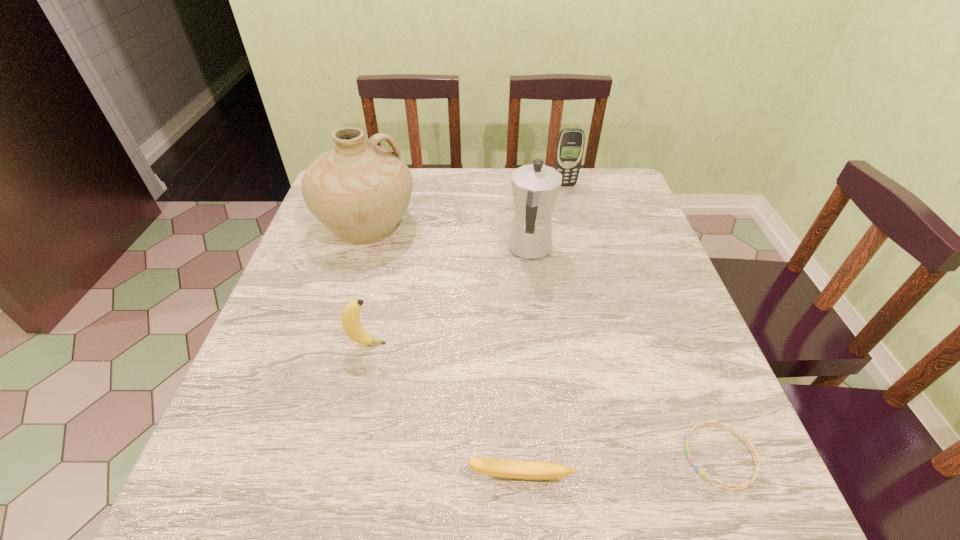
Where is `free space at the right edge of the desktop`? This screenshot has width=960, height=540. free space at the right edge of the desktop is located at coordinates 657,303.

Locate an element on the screen. The width and height of the screenshot is (960, 540). vacant space at the near left corner of the desktop is located at coordinates (291, 495).

This screenshot has width=960, height=540. In the image, there is a desktop. Identify the location of free space at the far right corner. (588, 198).

At what (x,y) coordinates should I click in order to perform the action: click on empty location between the fourth farthest object and the rightmost object. Please return your answer as a coordinate pair (x, y). The width and height of the screenshot is (960, 540). Looking at the image, I should click on (543, 400).

The width and height of the screenshot is (960, 540). Identify the location of blank region between the pottery and the third nearest object. [368, 284].

Find the location of `vacant point located between the fourth farthest object and the shortest object`. vacant point located between the fourth farthest object and the shortest object is located at coordinates (543, 400).

Where is `empty space between the bracelet and the fourth tallest object`? The height and width of the screenshot is (540, 960). empty space between the bracelet and the fourth tallest object is located at coordinates (543, 400).

Where is `vacant area between the farthest object and the pottery`? The height and width of the screenshot is (540, 960). vacant area between the farthest object and the pottery is located at coordinates (466, 205).

Locate an element on the screen. Image resolution: width=960 pixels, height=540 pixels. free space between the coffeepot and the bracelet is located at coordinates (625, 352).

At what (x,y) coordinates should I click in order to perform the action: click on empty space between the fourth shortest object and the farther banana. Please return your answer as a coordinate pair (x, y). The width and height of the screenshot is (960, 540). Looking at the image, I should click on (466, 265).